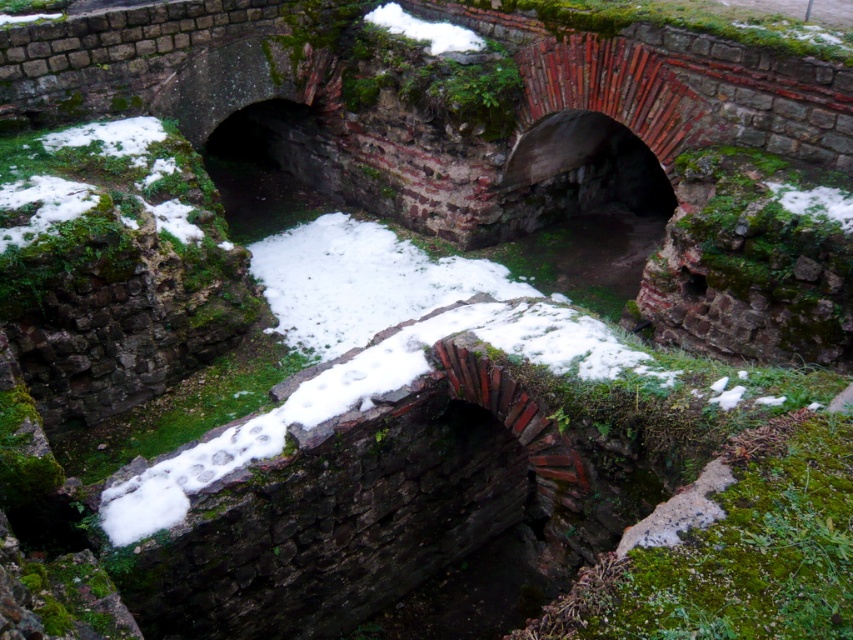
In the scene shown: You are an architect examining the ancient stone structure. You notice two patches of white fluffy snow at center and white fluffy snow at upper center. Which of these snow patches is bigger in size?

The white fluffy snow at center is larger in size than the white fluffy snow at upper center.